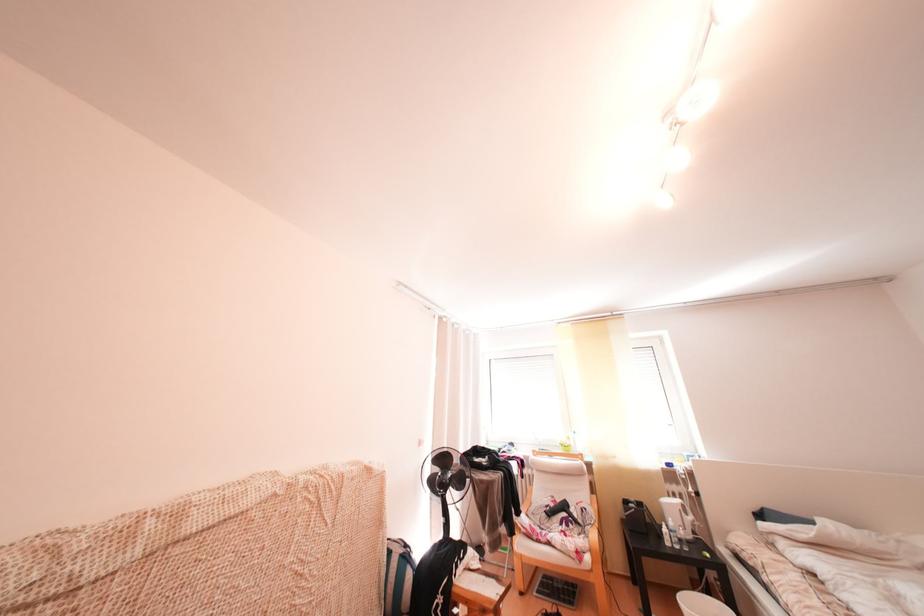
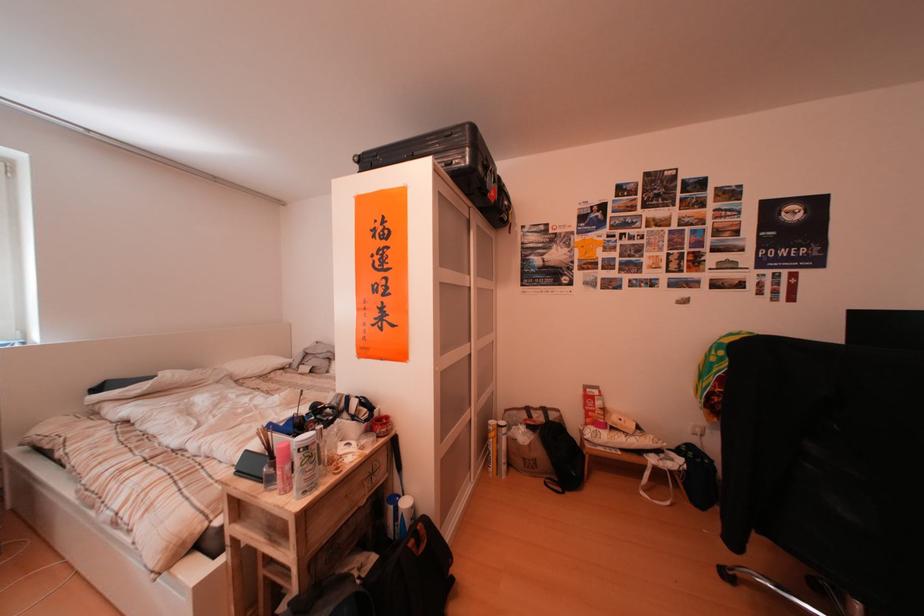
Question: The first image is from the beginning of the video and the second image is from the end. How did the camera likely rotate when shooting the video?

Choices:
 (A) Left
 (B) Right
 (C) Up
 (D) Down

Answer: (B)